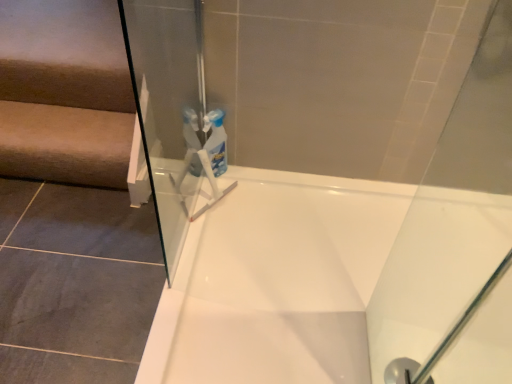
Question: Should I look upward or downward to see transparent glass shower at lower right?

Choices:
 (A) down
 (B) up

Answer: (A)

Question: Can you confirm if beige fabric stairwell at left is taller than white glossy bathtub at center?

Choices:
 (A) yes
 (B) no

Answer: (A)

Question: From the image's perspective, is beige fabric stairwell at left located above white glossy bathtub at center?

Choices:
 (A) yes
 (B) no

Answer: (A)

Question: Is beige fabric stairwell at left further to the viewer compared to white glossy bathtub at center?

Choices:
 (A) no
 (B) yes

Answer: (B)

Question: Is beige fabric stairwell at left facing towards white glossy bathtub at center?

Choices:
 (A) no
 (B) yes

Answer: (A)

Question: Would you say beige fabric stairwell at left is outside white glossy bathtub at center?

Choices:
 (A) yes
 (B) no

Answer: (A)

Question: Considering the relative sizes of beige fabric stairwell at left and white glossy bathtub at center in the image provided, is beige fabric stairwell at left smaller than white glossy bathtub at center?

Choices:
 (A) no
 (B) yes

Answer: (B)

Question: Is beige fabric stairwell at left wider than transparent glass shower at lower right?

Choices:
 (A) no
 (B) yes

Answer: (B)

Question: Is beige fabric stairwell at left positioned with its back to transparent glass shower at lower right?

Choices:
 (A) yes
 (B) no

Answer: (B)

Question: Can you confirm if beige fabric stairwell at left is thinner than transparent glass shower at lower right?

Choices:
 (A) no
 (B) yes

Answer: (A)

Question: Considering the relative sizes of beige fabric stairwell at left and transparent glass shower at lower right in the image provided, is beige fabric stairwell at left shorter than transparent glass shower at lower right?

Choices:
 (A) no
 (B) yes

Answer: (A)

Question: From the image's perspective, is beige fabric stairwell at left on top of transparent glass shower at lower right?

Choices:
 (A) no
 (B) yes

Answer: (B)

Question: Are beige fabric stairwell at left and transparent glass shower at lower right far apart?

Choices:
 (A) yes
 (B) no

Answer: (A)

Question: Is white glossy bathtub at center positioned with its back to transparent glass shower at lower right?

Choices:
 (A) no
 (B) yes

Answer: (B)